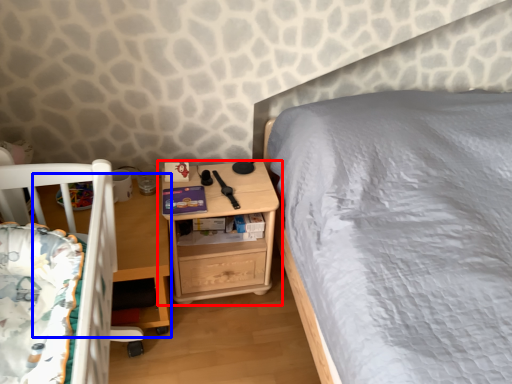
Question: Among these objects, which one is farthest to the camera, nightstand (highlighted by a red box) or table (highlighted by a blue box)?

Choices:
 (A) nightstand
 (B) table

Answer: (A)